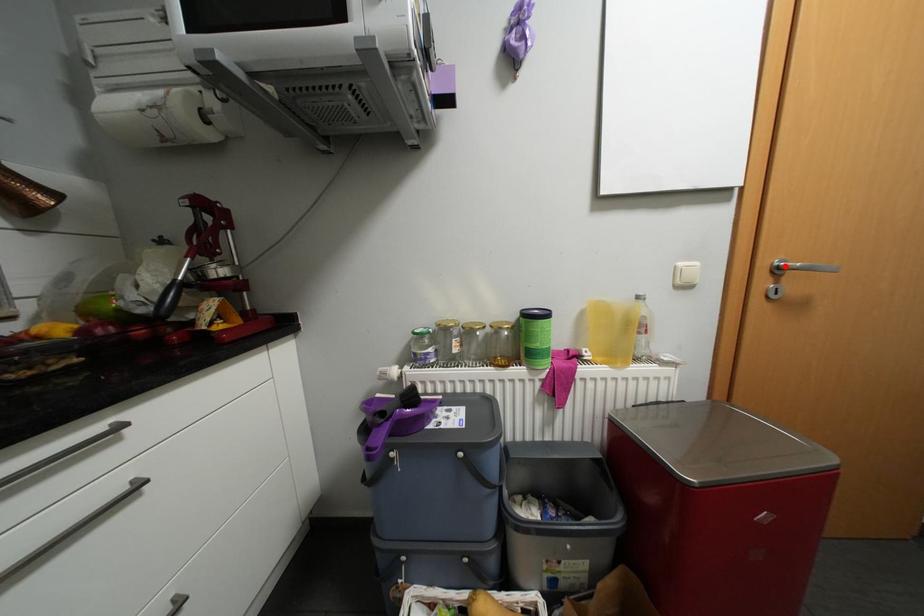
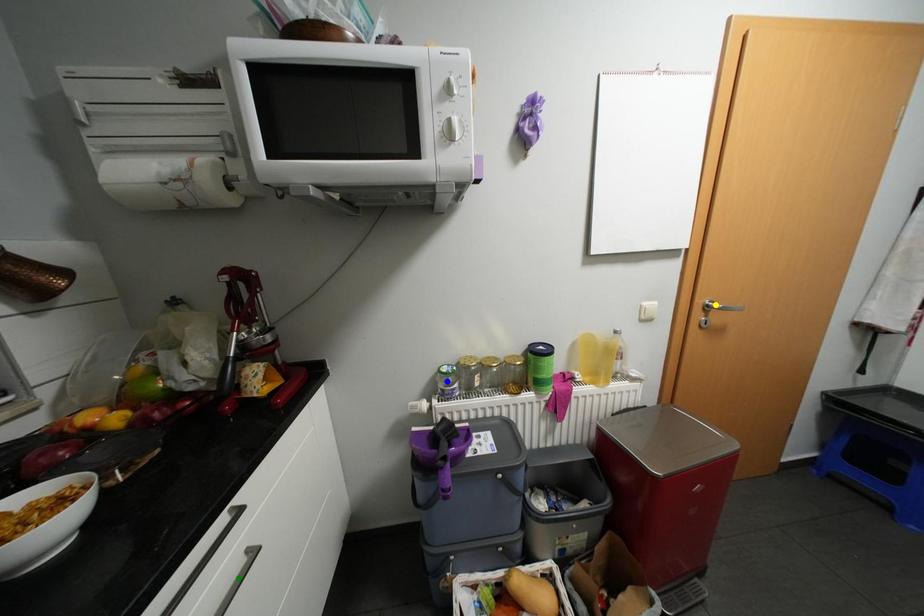
Question: I am providing you with two images of the same scene from different viewpoints. A red point is marked on the first image. You are given multiple points on the second image. In image 2, which mark is for the same physical point as the one in image 1?

Choices:
 (A) blue point
 (B) green point
 (C) yellow point

Answer: (C)